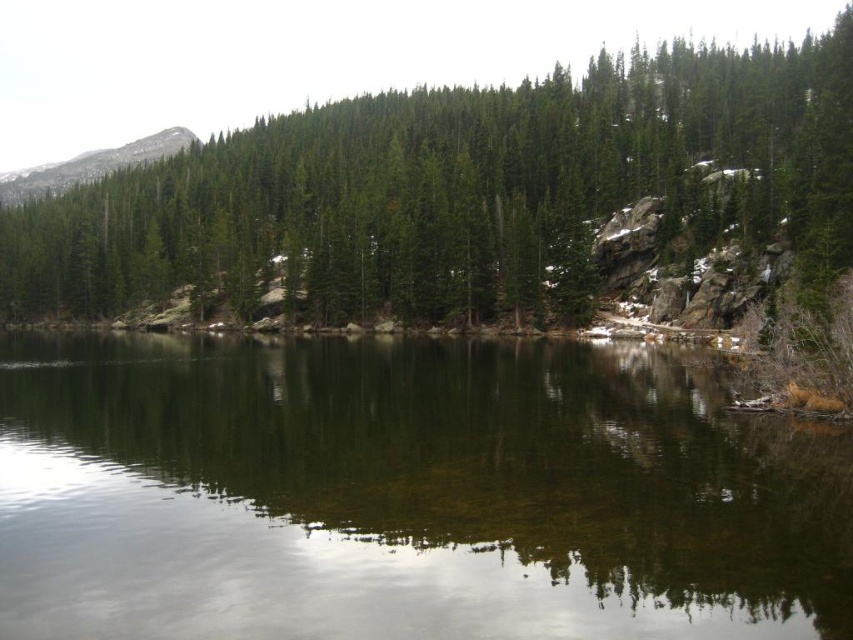
You are standing at the edge of the scene and want to find the green reflective water at center. Based on its coordinates, in which general direction should you look? Choose from north, south, east, or west?

The green reflective water at center is located at coordinates approximately 0.773 on the x and 0.477 on the y. Since the x coordinate is closer to 1, it is positioned more to the east, so you should look east.

You are standing at the point with coordinates point (68, 170) and want to move towards the mountain range in the background. Is the point (386, 353) located between you and the mountains?

Yes, the point (386, 353) is between you and the mountains because it is closer to the viewer than point (68, 170), which is your current position.